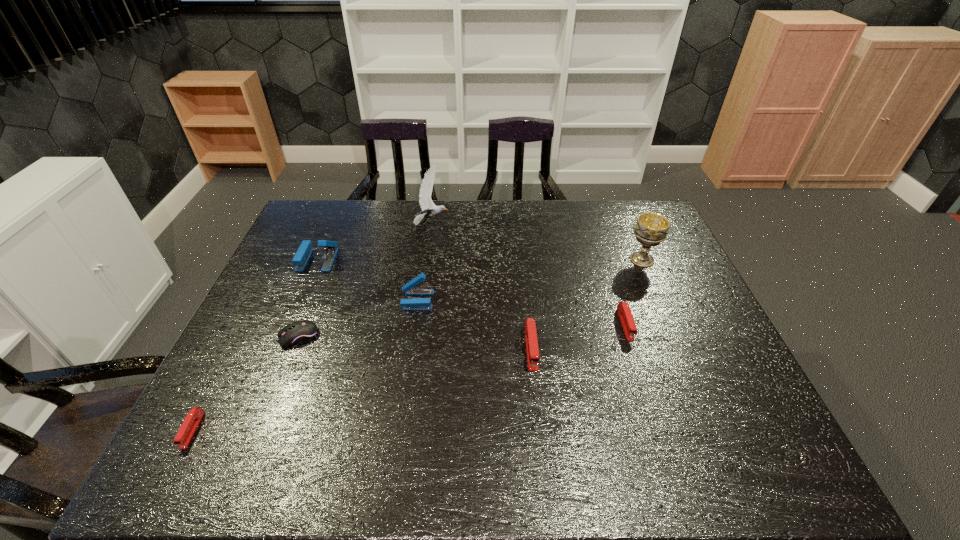
The width and height of the screenshot is (960, 540). Find the location of `gull`. gull is located at coordinates (429, 209).

Locate an element on the screen. The height and width of the screenshot is (540, 960). the rightmost object is located at coordinates (651, 229).

The height and width of the screenshot is (540, 960). What are the coordinates of `chalice` in the screenshot? It's located at (651, 229).

Image resolution: width=960 pixels, height=540 pixels. In order to click on the bigger blue stapler in this screenshot , I will do `click(303, 253)`.

At what (x,y) coordinates should I click in order to perform the action: click on the tallest stapler. Please return your answer as a coordinate pair (x, y). Looking at the image, I should click on (303, 253).

Where is `the nearer blue stapler`? the nearer blue stapler is located at coordinates (411, 288).

This screenshot has height=540, width=960. In order to click on the fourth shortest stapler in this screenshot , I will do click(411, 288).

The width and height of the screenshot is (960, 540). In order to click on the fifth tallest object in this screenshot , I will do 533,359.

You are a GUI agent. You are given a task and a screenshot of the screen. Output one action in this format:
    pyautogui.click(x=<x>, y=<y>)
    Task: Click on the biggest red stapler
    
    Given the screenshot: What is the action you would take?
    pyautogui.click(x=533, y=359)

Find the location of `the second smallest red stapler`. the second smallest red stapler is located at coordinates (624, 311).